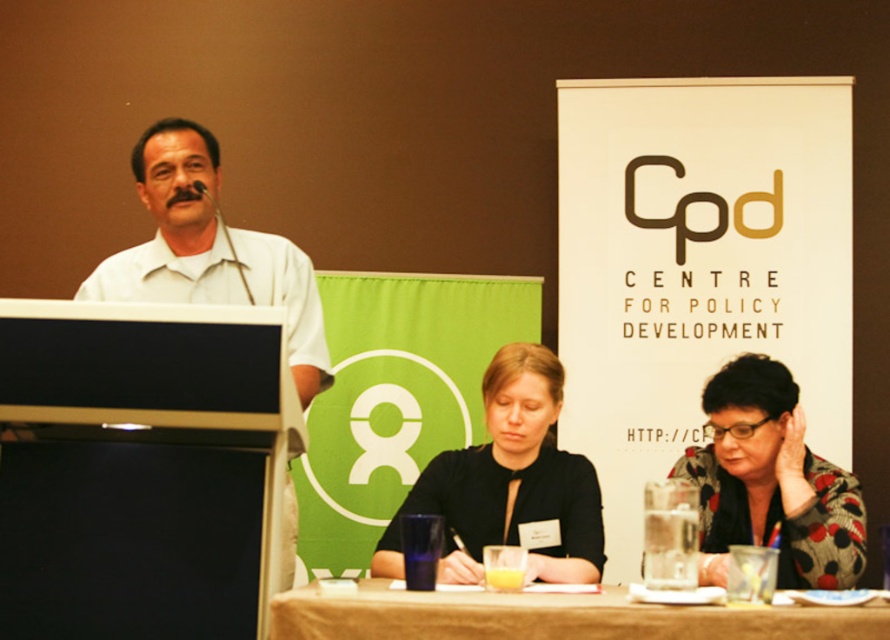
Question: Can you confirm if white matte shirt at left is bigger than brown wooden table at lower center?

Choices:
 (A) no
 (B) yes

Answer: (B)

Question: Can you confirm if polka dot fabric jacket at lower right is wider than white matte shirt at left?

Choices:
 (A) yes
 (B) no

Answer: (B)

Question: Is matte black shirt at center to the right of polka dot fabric jacket at lower right from the viewer's perspective?

Choices:
 (A) no
 (B) yes

Answer: (A)

Question: Which object is the farthest from the brown wooden table at lower center?

Choices:
 (A) polka dot fabric jacket at lower right
 (B) white matte shirt at left
 (C) matte black shirt at center

Answer: (B)

Question: Which object is closer to the camera taking this photo?

Choices:
 (A) polka dot fabric jacket at lower right
 (B) matte black shirt at center
 (C) white matte shirt at left

Answer: (A)

Question: Estimate the real-world distances between objects in this image. Which object is closer to the brown wooden table at lower center?

Choices:
 (A) white matte shirt at left
 (B) polka dot fabric jacket at lower right
 (C) matte black shirt at center

Answer: (C)